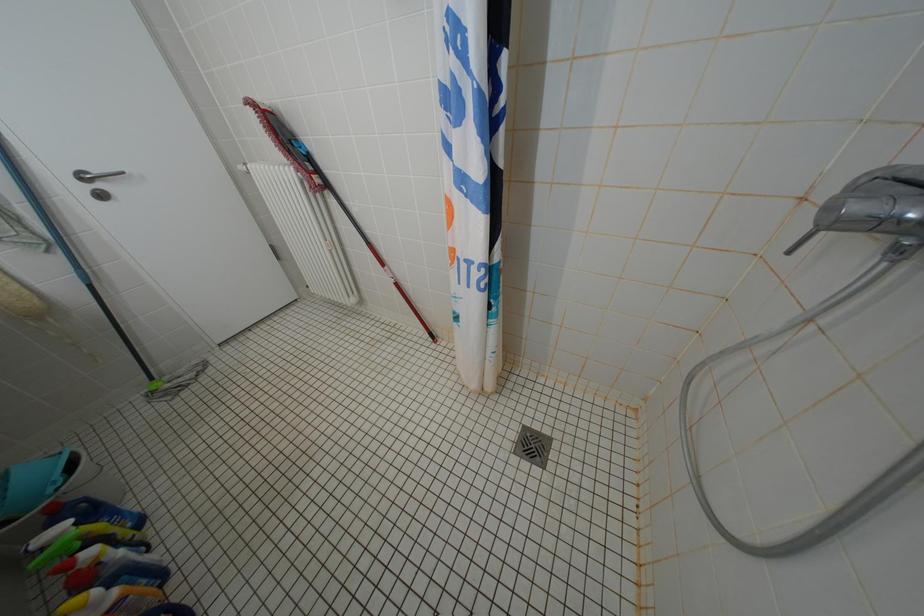
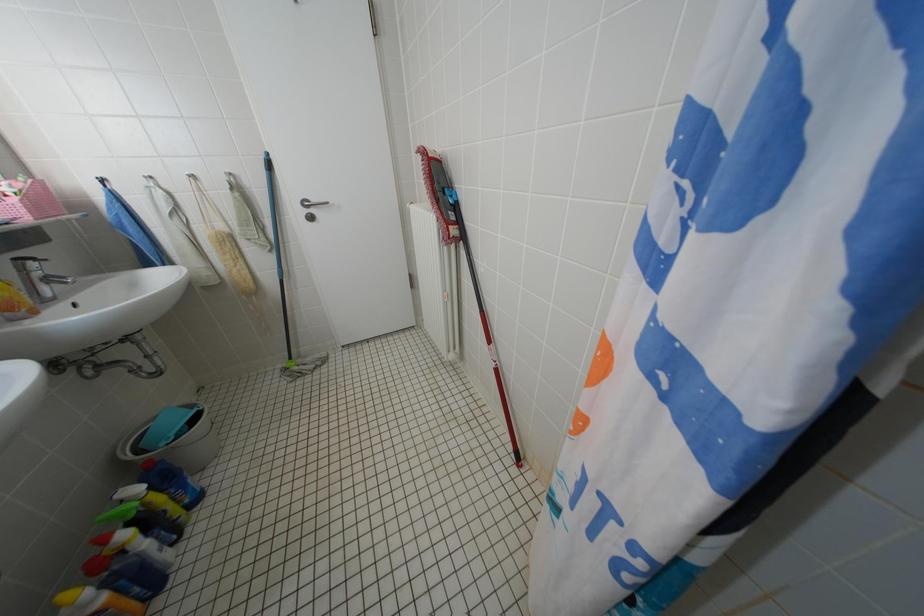
Question: How did the camera likely rotate?

Choices:
 (A) Left
 (B) Right
 (C) Up
 (D) Down

Answer: (A)